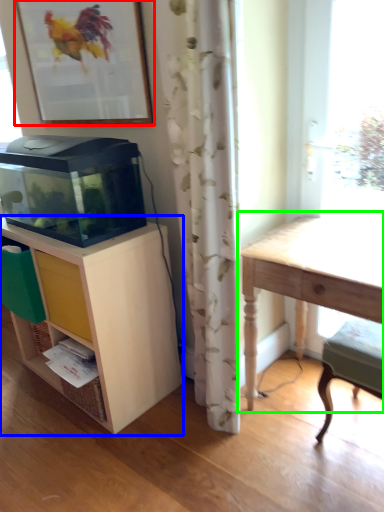
Question: Based on their relative distances, which object is farther from picture frame (highlighted by a red box)? Choose from shelf (highlighted by a blue box) and table (highlighted by a green box).

Choices:
 (A) shelf
 (B) table

Answer: (B)